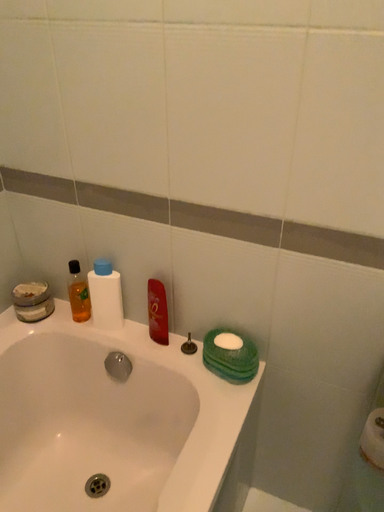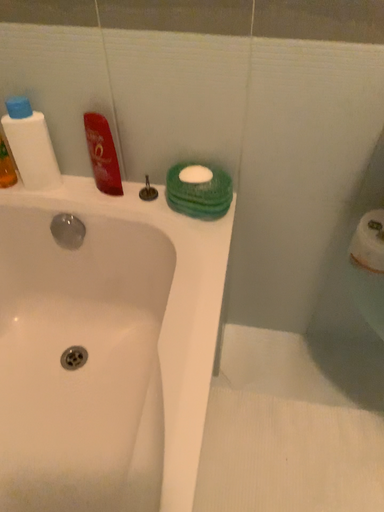
Question: How did the camera likely rotate when shooting the video?

Choices:
 (A) rotated right
 (B) rotated left

Answer: (A)